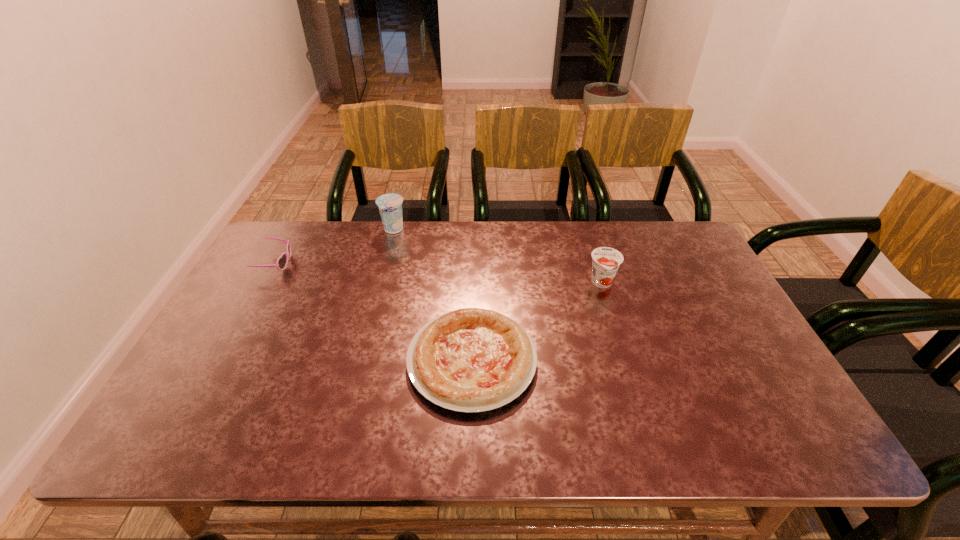
Find the location of a particular element. the taller yogurt is located at coordinates (390, 205).

Find the location of a particular element. the farther yogurt is located at coordinates (390, 205).

Find the location of `the right yogurt`. the right yogurt is located at coordinates (606, 261).

Find the location of `the third shortest object`. the third shortest object is located at coordinates (606, 261).

Locate an element on the screen. The width and height of the screenshot is (960, 540). sunglasses is located at coordinates (281, 263).

Image resolution: width=960 pixels, height=540 pixels. I want to click on pizza, so click(469, 360).

You are a GUI agent. You are given a task and a screenshot of the screen. Output one action in this format:
    pyautogui.click(x=<x>, y=<y>)
    Task: Click on the nearest object
    Image resolution: width=960 pixels, height=540 pixels.
    Given the screenshot: What is the action you would take?
    pyautogui.click(x=469, y=360)

Find the location of a particular element. Image resolution: width=960 pixels, height=540 pixels. vacant point located on the front of the taller yogurt is located at coordinates (375, 299).

The height and width of the screenshot is (540, 960). In order to click on vacant space positioned on the back of the rightmost object in this screenshot , I will do `click(585, 227)`.

Locate an element on the screen. This screenshot has height=540, width=960. free space located 0.060m on the front-facing side of the sunglasses is located at coordinates (310, 263).